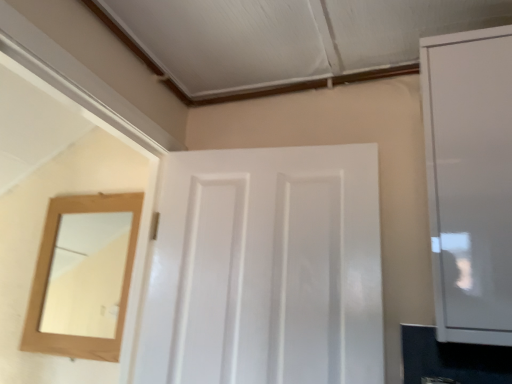
Question: Is point (489, 46) positioned closer to the camera than point (162, 372)?

Choices:
 (A) farther
 (B) closer

Answer: (B)

Question: Looking at the image, does white glossy cabinet at right seem bigger or smaller compared to white glossy door at center?

Choices:
 (A) small
 (B) big

Answer: (A)

Question: From the image's perspective, is white glossy cabinet at right positioned above or below white glossy door at center?

Choices:
 (A) above
 (B) below

Answer: (A)

Question: From the image's perspective, relative to white glossy cabinet at right, is white glossy door at center above or below?

Choices:
 (A) above
 (B) below

Answer: (B)

Question: Considering their positions, is white glossy door at center located in front of or behind white glossy cabinet at right?

Choices:
 (A) behind
 (B) front

Answer: (A)

Question: Is white glossy door at center inside or outside of white glossy cabinet at right?

Choices:
 (A) outside
 (B) inside

Answer: (A)

Question: Is white glossy door at center bigger or smaller than white glossy cabinet at right?

Choices:
 (A) big
 (B) small

Answer: (A)